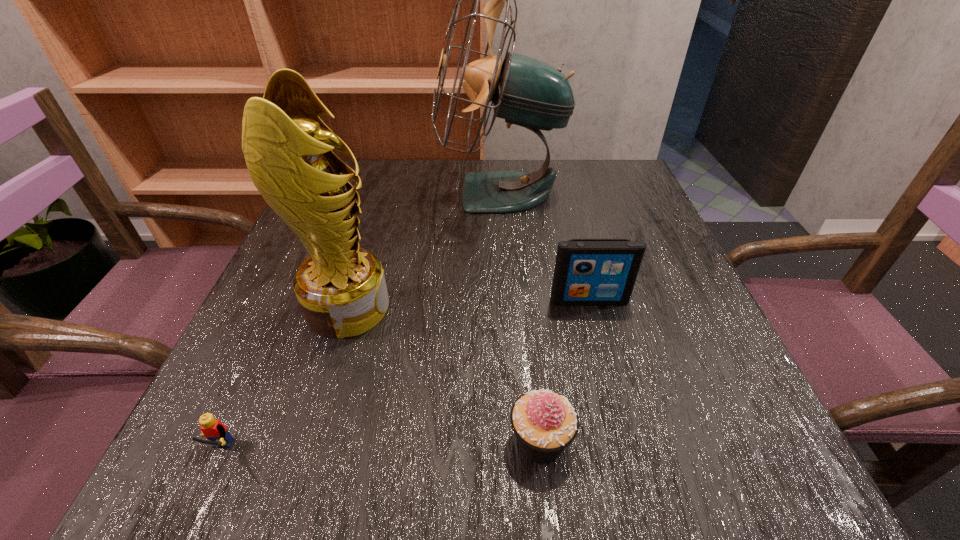
Image resolution: width=960 pixels, height=540 pixels. I want to click on vacant space that satisfies the following two spatial constraints: 1. on the front-facing side of the fourth tallest object for air flow; 2. on the left side of the farthest object, so click(516, 441).